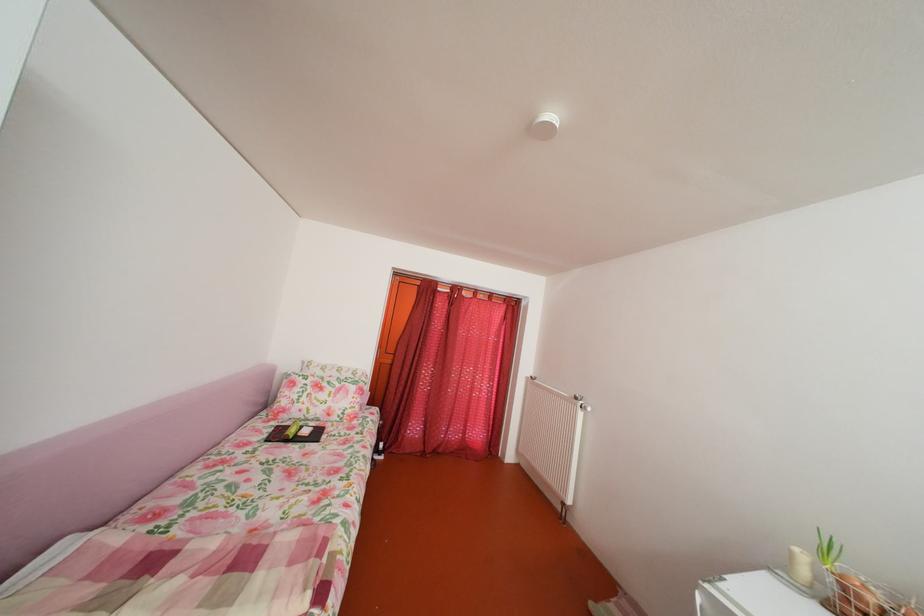
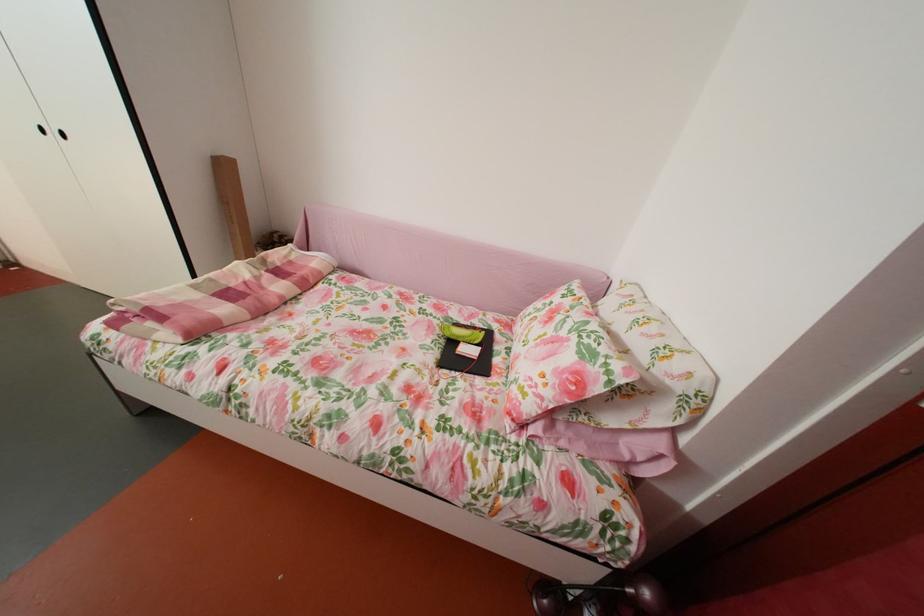
Locate, in the second image, the point that corresponds to point (163, 588) in the first image.

(274, 278)